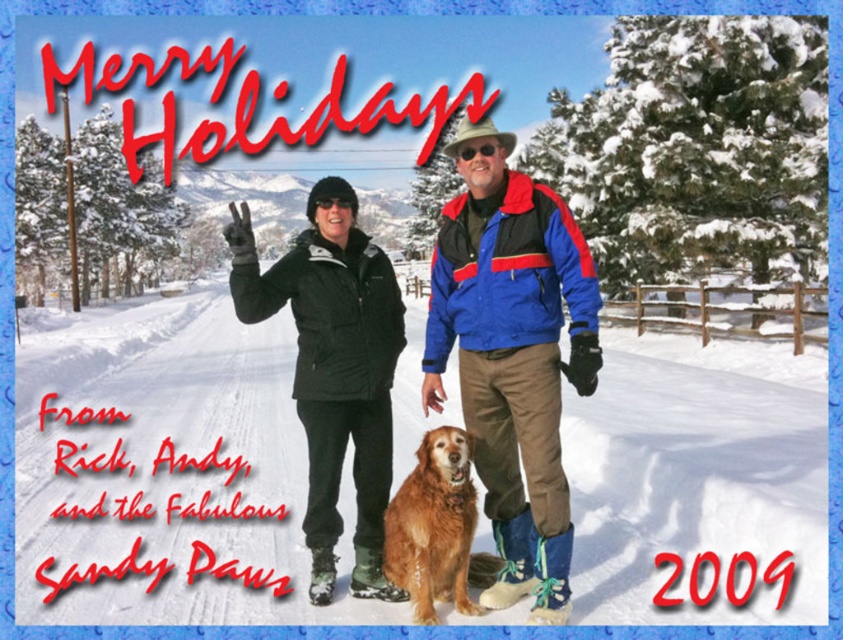
From the picture: You are looking at the holiday greeting card and see two people in jackets. Which jacket is positioned to the right of the other? The jackets are the matte black jacket at center and the black nylon jacket at center.

The matte black jacket at center is positioned to the right of the black nylon jacket at center.